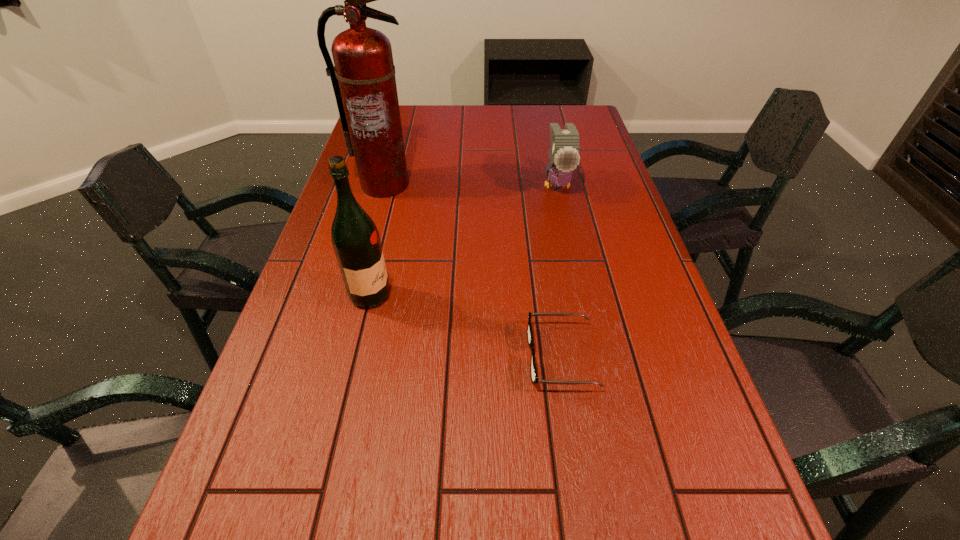
Locate an element on the screen. This screenshot has width=960, height=540. fire extinguisher is located at coordinates coord(363,78).

Locate an element on the screen. the third farthest object is located at coordinates (355, 238).

The height and width of the screenshot is (540, 960). I want to click on liquor, so click(355, 238).

Find the location of a particular element. The image size is (960, 540). bird is located at coordinates (564, 157).

This screenshot has height=540, width=960. I want to click on the nearest object, so click(534, 376).

The height and width of the screenshot is (540, 960). I want to click on spectacles, so click(x=534, y=376).

This screenshot has width=960, height=540. In order to click on free location located on the side of the fire extinguisher with the handle and hose in this screenshot , I will do `click(377, 211)`.

You are a GUI agent. You are given a task and a screenshot of the screen. Output one action in this format:
    pyautogui.click(x=<x>, y=<y>)
    Task: Click on the free space located 0.350m on the front-facing side of the liquor
    The height and width of the screenshot is (540, 960).
    Given the screenshot: What is the action you would take?
    pyautogui.click(x=536, y=296)

Locate an element on the screen. This screenshot has width=960, height=540. vacant space located at the beak of the bird is located at coordinates (583, 300).

In order to click on vacant space located on the front-facing side of the nearest object in this screenshot , I will do `click(410, 356)`.